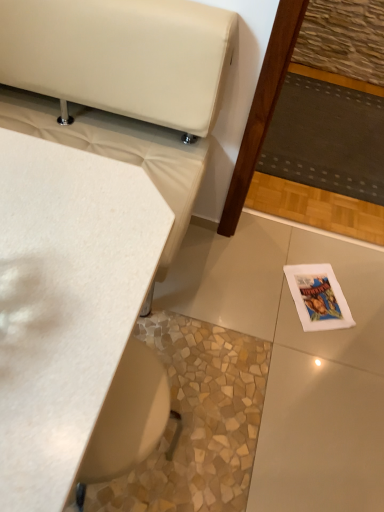
Find the location of a particular element. The image size is (384, 512). free space in front of white paper magazine at lower right is located at coordinates (318, 349).